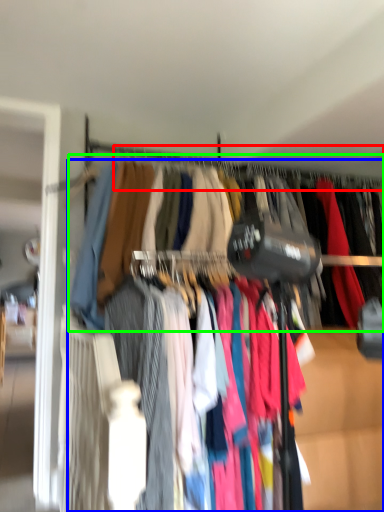
Question: Estimate the real-world distances between objects in this image. Which object is closer to clothesline (highlighted by a red box), trousers (highlighted by a blue box) or closet (highlighted by a green box)?

Choices:
 (A) trousers
 (B) closet

Answer: (B)